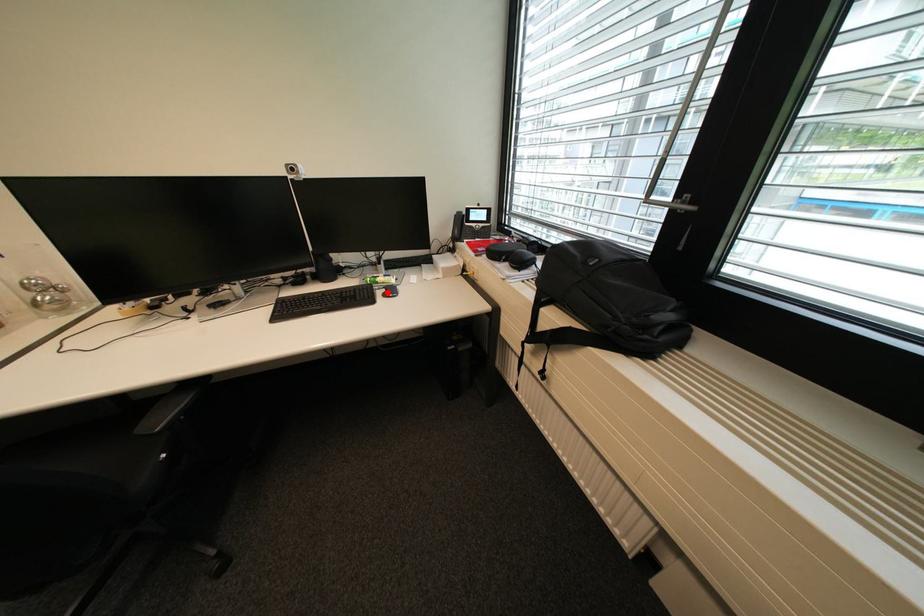
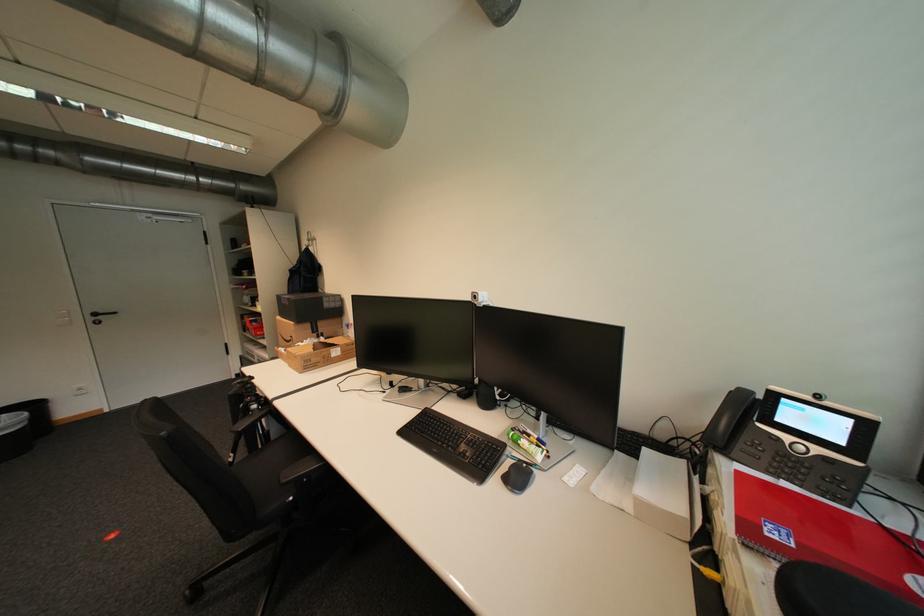
Where in the second image is the point corresponding to the highlighted location from the first image?

(514, 467)